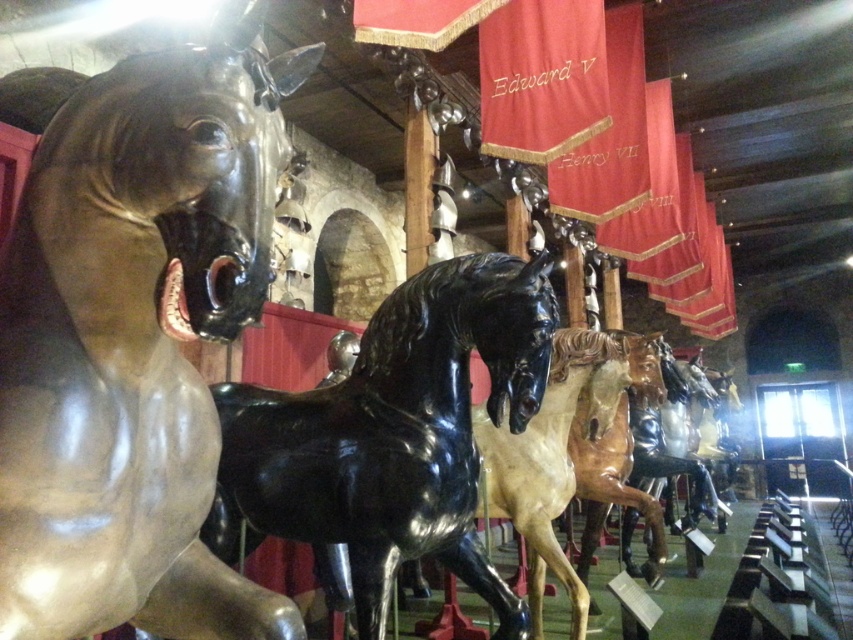
Find the location of a particular element. The image size is (853, 640). shiny bronze horse at left is located at coordinates (132, 333).

Is shiny bronze horse at left positioned behind glossy black horse at center?

No, it is in front of glossy black horse at center.

Find the location of `shiny bronze horse at left`. shiny bronze horse at left is located at coordinates (132, 333).